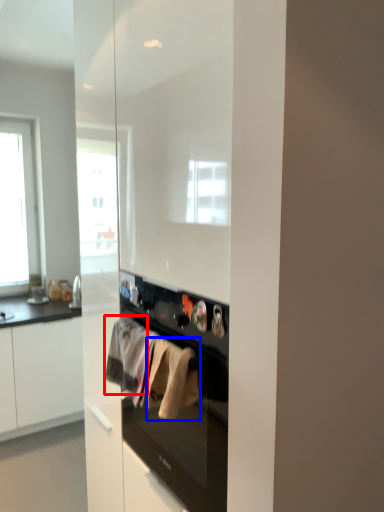
Question: Among these objects, which one is nearest to the camera, clothing (highlighted by a red box) or clothing (highlighted by a blue box)?

Choices:
 (A) clothing
 (B) clothing

Answer: (B)